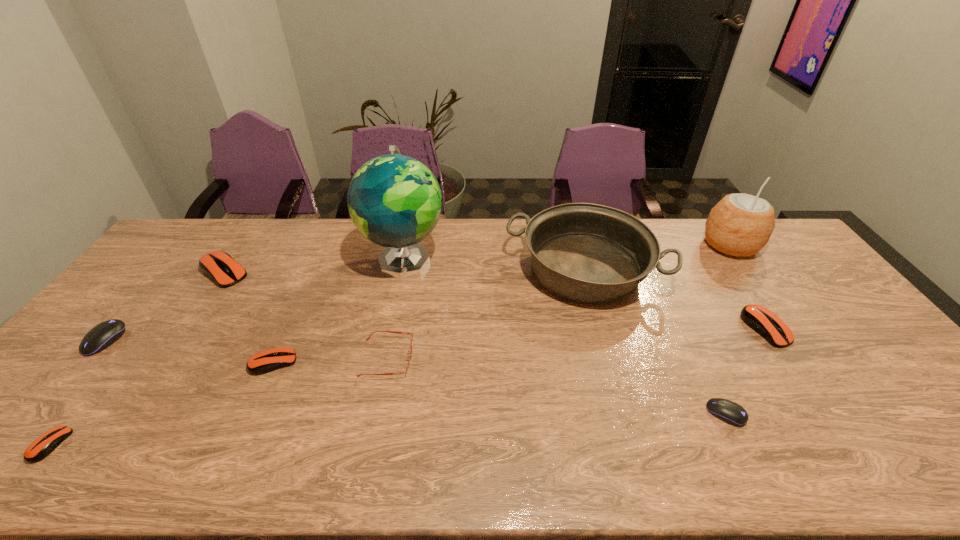
The height and width of the screenshot is (540, 960). I want to click on spectacles, so click(397, 332).

Find the location of a particular element. Image resolution: width=960 pixels, height=540 pixels. the third farthest orange computer mouse is located at coordinates [x=266, y=361].

Where is `the third computer mouse from right to left`? The image size is (960, 540). the third computer mouse from right to left is located at coordinates (266, 361).

Identify the location of the smaller black computer mouse. (730, 412).

Where is `the second computer mouse from right to left`? the second computer mouse from right to left is located at coordinates (730, 412).

This screenshot has width=960, height=540. In order to click on the nearest orange computer mouse in this screenshot , I will do `click(44, 445)`.

Locate an element on the screen. This screenshot has height=540, width=960. the shortest object is located at coordinates (44, 445).

The image size is (960, 540). Identify the location of vacant area situated 0.080m on the front surface of the tallest object. (395, 308).

Where is `free space located on the front of the second tallest object`? This screenshot has height=540, width=960. free space located on the front of the second tallest object is located at coordinates (753, 276).

Locate an element on the screen. The height and width of the screenshot is (540, 960). vacant space located 0.160m on the front of the eighth shortest object is located at coordinates (609, 359).